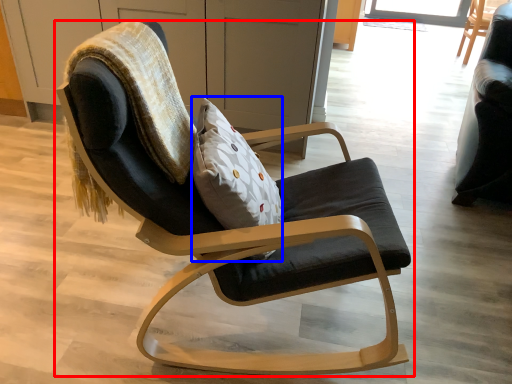
Question: Which of the following is the farthest to the observer, chair (highlighted by a red box) or pillow (highlighted by a blue box)?

Choices:
 (A) chair
 (B) pillow

Answer: (B)